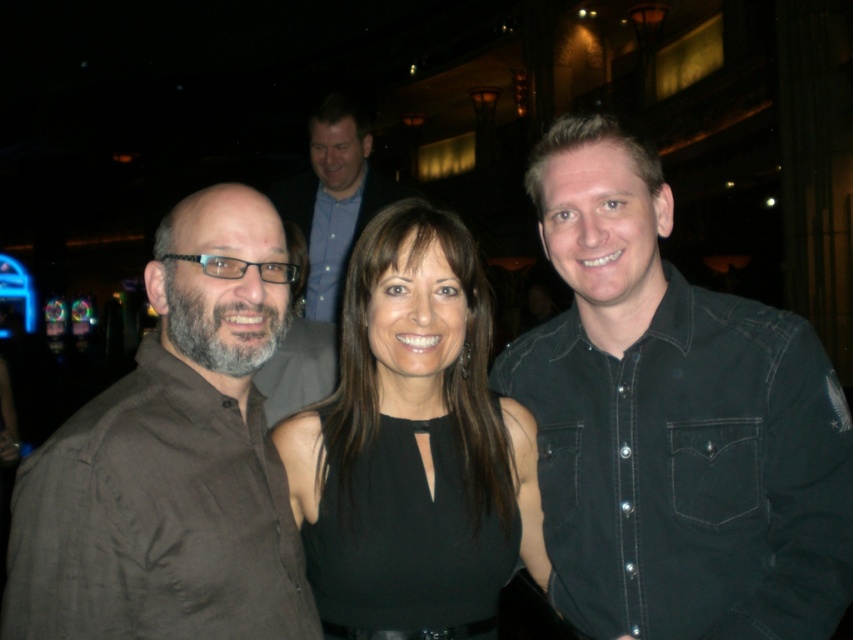
You are standing in the casino and want to take a photo of the black denim shirt at center. Where should you aim your camera to capture it?

You should aim your camera at the coordinates point (672,422) to capture the black denim shirt at center.

You are a photographer at the event and want to ensure that both the black denim shirt at center and the black matte dress at center are clearly visible in the photo. Based on their positions, which one should you focus on to make sure it appears sharp and in focus?

The black denim shirt at center is in front of the black matte dress at center, so focusing on the black denim shirt at center will ensure it appears sharp while the dress may appear slightly out of focus. Alternatively, focusing between them might achieve both in focus but requires precise adjustment.